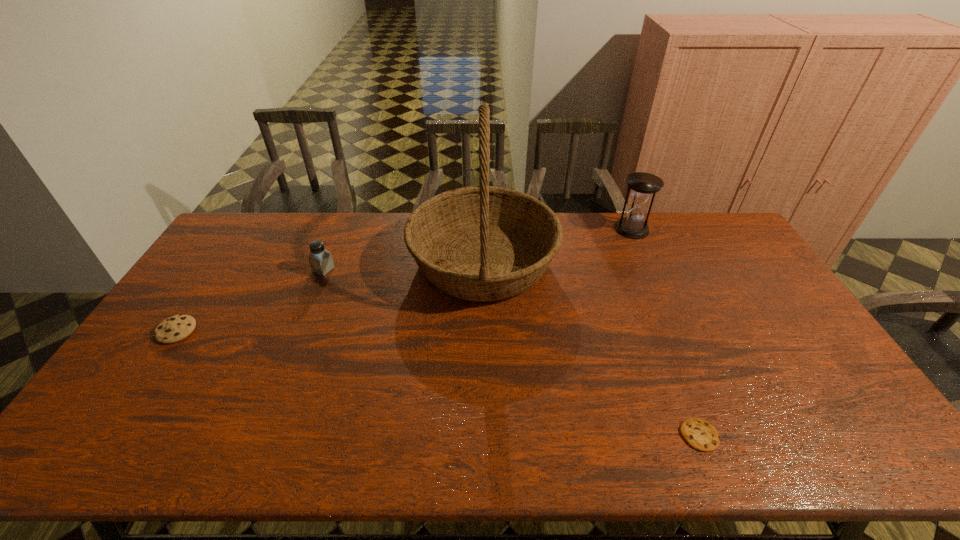
Where is `free space that is in between the shorter cookie and the second shortest object`? The height and width of the screenshot is (540, 960). free space that is in between the shorter cookie and the second shortest object is located at coordinates pos(438,383).

Choose which object is the fourth nearest neighbor to the third object from right to left. Please provide its 2D coordinates. Your answer should be formatted as a tuple, i.e. [(x, y)], where the tuple contains the x and y coordinates of a point satisfying the conditions above.

[(176, 328)]

Locate an element on the screen. This screenshot has height=540, width=960. object that can be found as the second closest to the saltshaker is located at coordinates (176, 328).

At what (x,y) coordinates should I click in order to perform the action: click on free location that satisfies the following two spatial constraints: 1. on the back side of the hourglass; 2. on the left side of the farther cookie. Please return your answer as a coordinate pair (x, y). The height and width of the screenshot is (540, 960). Looking at the image, I should click on (245, 229).

Identify the location of free space in the image that satisfies the following two spatial constraints: 1. on the back side of the second shortest object; 2. on the left side of the third object from left to right. The height and width of the screenshot is (540, 960). (224, 261).

Locate an element on the screen. vacant space that satisfies the following two spatial constraints: 1. on the back side of the fourth shortest object; 2. on the left side of the nearest object is located at coordinates [618, 229].

You are a GUI agent. You are given a task and a screenshot of the screen. Output one action in this format:
    pyautogui.click(x=<x>, y=<y>)
    Task: Click on the vacant space that satisfies the following two spatial constraints: 1. on the back side of the third tallest object; 2. on the left side of the second tallest object
    
    Given the screenshot: What is the action you would take?
    pyautogui.click(x=340, y=229)